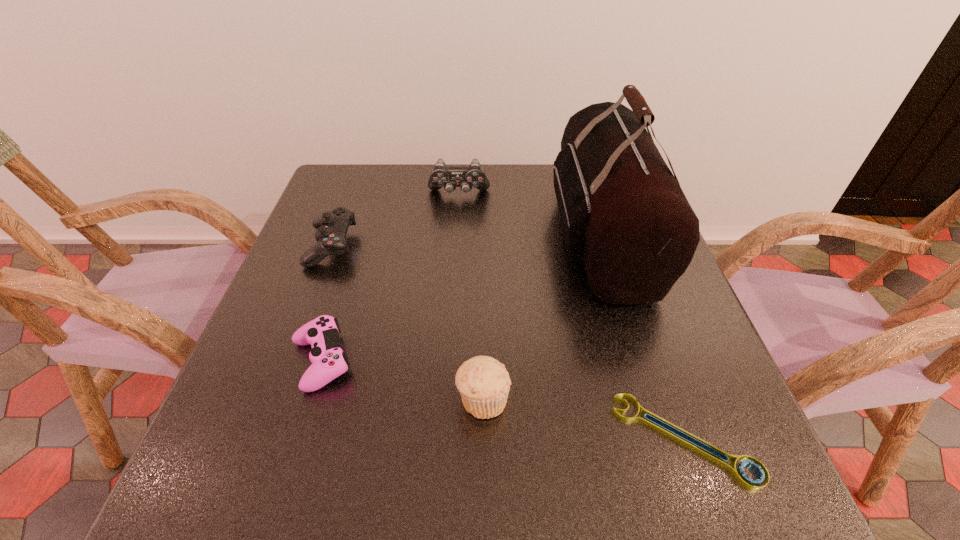
Find the location of a particular element. Image resolution: width=960 pixels, height=540 pixels. duffel bag positioned at the right edge is located at coordinates (624, 216).

Locate an element on the screen. The width and height of the screenshot is (960, 540). wrench that is at the right edge is located at coordinates (739, 474).

Identify the location of object present at the far right corner. The width and height of the screenshot is (960, 540). (624, 216).

I want to click on object present at the near right corner, so click(739, 474).

In the image, there is a desktop. Where is `vacant area at the far edge`? The image size is (960, 540). vacant area at the far edge is located at coordinates (546, 185).

The height and width of the screenshot is (540, 960). Identify the location of vacant area at the near edge of the desktop. pos(387,503).

The width and height of the screenshot is (960, 540). I want to click on vacant space at the left edge of the desktop, so click(259, 430).

Where is `blank space at the right edge of the desktop`? blank space at the right edge of the desktop is located at coordinates (641, 346).

The image size is (960, 540). Identify the location of vacant space at the far left corner of the desktop. (331, 172).

Locate an element on the screen. The image size is (960, 540). vacant space in between the tallest control and the nearest control is located at coordinates (390, 278).